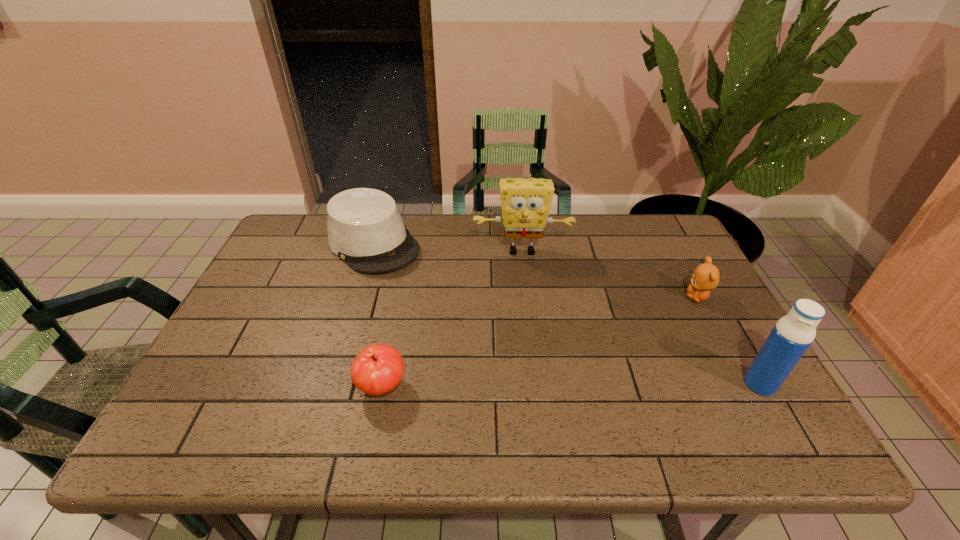
Identify the location of vacant area that lies between the apple and the third farthest object. The width and height of the screenshot is (960, 540). (540, 342).

Where is `unoccupied position between the hat and the third object from left to right`? The height and width of the screenshot is (540, 960). unoccupied position between the hat and the third object from left to right is located at coordinates (447, 247).

Locate which object is the second closest to the apple. Please provide its 2D coordinates. Your answer should be formatted as a tuple, i.e. [(x, y)], where the tuple contains the x and y coordinates of a point satisfying the conditions above.

[(525, 203)]

This screenshot has height=540, width=960. I want to click on the third closest object to the hat, so click(706, 276).

Find the location of `free space that satisfies the following two spatial constraints: 1. on the back side of the apple; 2. on the right side of the water bottle`. free space that satisfies the following two spatial constraints: 1. on the back side of the apple; 2. on the right side of the water bottle is located at coordinates (382, 384).

Where is `free space that satisfies the following two spatial constraints: 1. on the back side of the apple; 2. on the left side of the water bottle`? The width and height of the screenshot is (960, 540). free space that satisfies the following two spatial constraints: 1. on the back side of the apple; 2. on the left side of the water bottle is located at coordinates (382, 384).